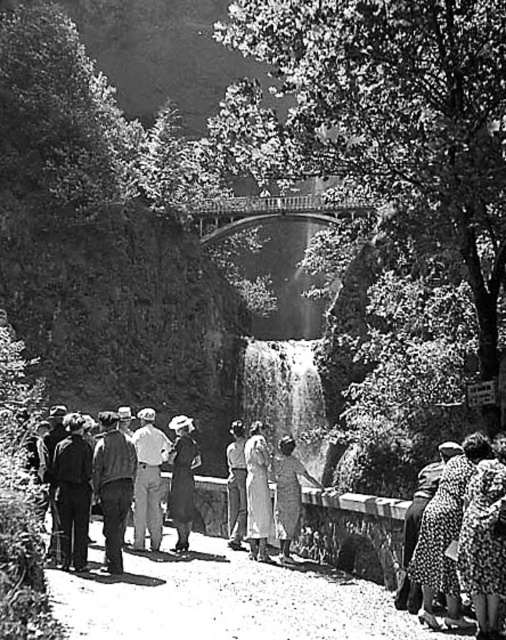
Question: Estimate the real-world distances between objects in this image. Which object is closer to the denim jacket at center?

Choices:
 (A) smooth concrete path at center
 (B) smooth stone waterfall at center
 (C) light gray cotton shirt at center

Answer: (C)

Question: Is dark brown leather coat at center below dark gray wool coat at center?

Choices:
 (A) yes
 (B) no

Answer: (A)

Question: Which of the following is the closest to the observer?

Choices:
 (A) light gray cotton shirt at center
 (B) smooth concrete path at center

Answer: (B)

Question: Which object is the farthest from the light gray cotton shirt at center?

Choices:
 (A) denim jacket at center
 (B) smooth fabric dress at center
 (C) dark brown leather coat at center
 (D) dotted fabric dress at lower right

Answer: (D)

Question: Can you confirm if dotted fabric dress at lower right is positioned below light gray cotton shirt at center?

Choices:
 (A) no
 (B) yes

Answer: (B)

Question: Is dark brown leather coat at center in front of dark gray wool coat at center?

Choices:
 (A) no
 (B) yes

Answer: (B)